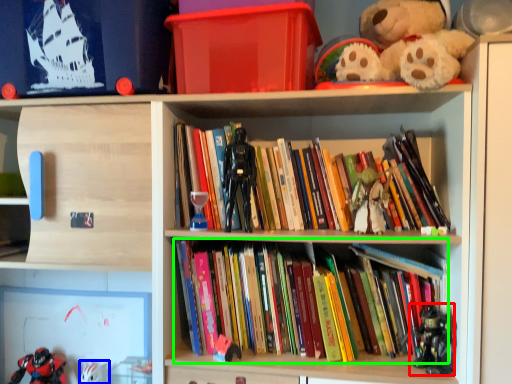
Question: Considering the real-world distances, which object is farthest from toy (highlighted by a red box)? toy (highlighted by a blue box) or book (highlighted by a green box)?

Choices:
 (A) toy
 (B) book

Answer: (A)